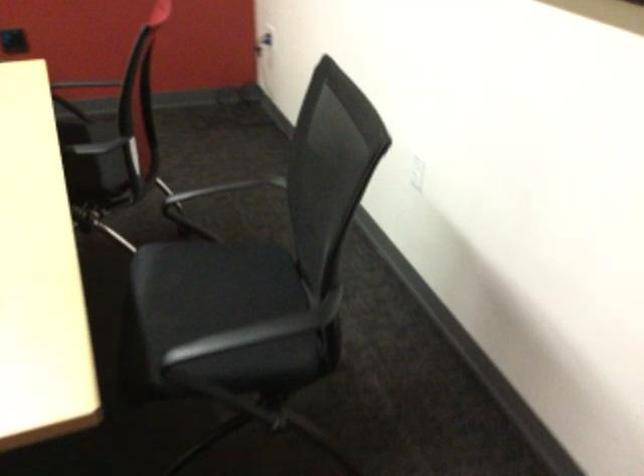
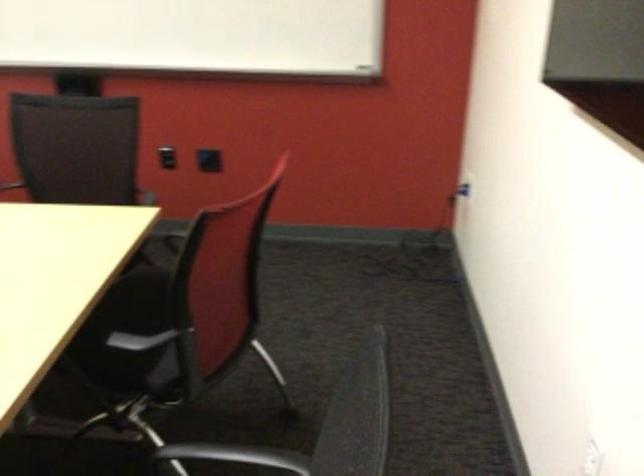
Based on the photo, in a continuous first-person perspective shot, in which direction is the camera moving?

The cameraman walked toward right, forward.